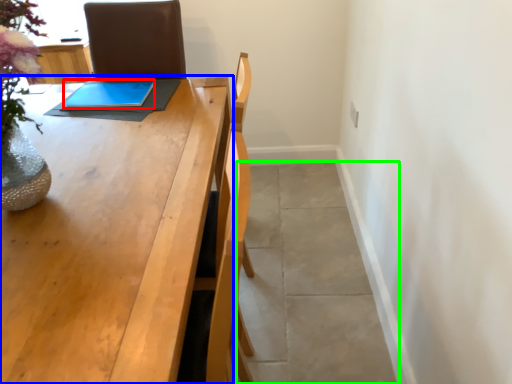
Question: Considering the real-world distances, which object is farthest from tablet computer (highlighted by a red box)? table (highlighted by a blue box) or concrete (highlighted by a green box)?

Choices:
 (A) table
 (B) concrete

Answer: (B)